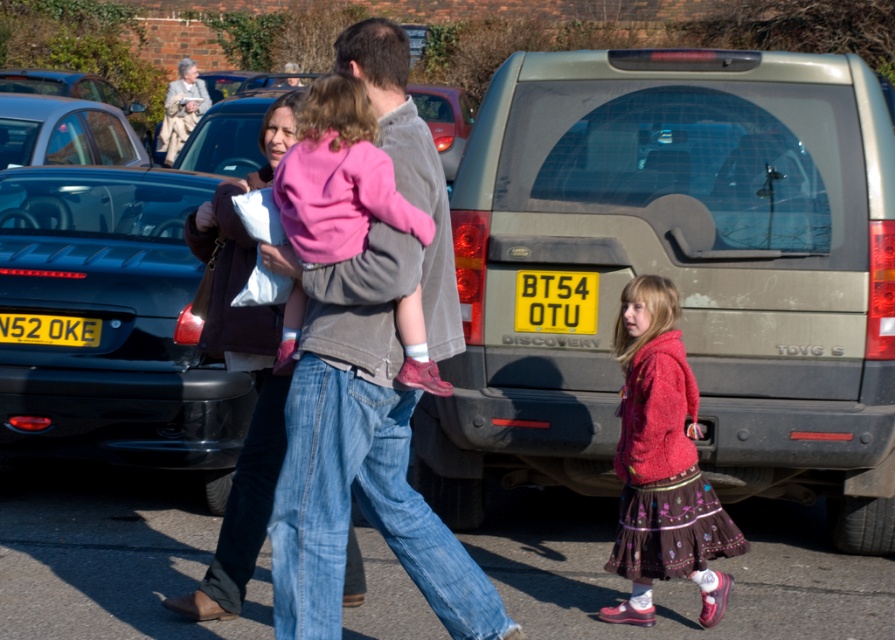
Who is positioned more to the left, fuzzy pink jacket at lower right or pink fleece jacket at center?

Positioned to the left is pink fleece jacket at center.

Is fuzzy pink jacket at lower right above pink fleece jacket at center?

No.

Is point (722, 509) positioned after point (339, 108)?

Yes, it is.

Locate an element on the screen. The height and width of the screenshot is (640, 895). fuzzy pink jacket at lower right is located at coordinates (662, 464).

From the picture: Can you confirm if matte gray minivan at center is positioned to the left of yellow plastic license plate at lower left?

No, matte gray minivan at center is not to the left of yellow plastic license plate at lower left.

Does matte gray minivan at center lie behind yellow plastic license plate at lower left?

No, matte gray minivan at center is closer to the viewer.

Is point (467, 385) positioned behind point (86, 323)?

No, (467, 385) is closer to viewer.

What are the coordinates of `matte gray minivan at center` in the screenshot? It's located at (679, 275).

Does matte brown jacket at center lie in front of pink fleece jacket at center?

No, it is behind pink fleece jacket at center.

Can you confirm if matte brown jacket at center is positioned to the right of pink fleece jacket at center?

Incorrect, matte brown jacket at center is not on the right side of pink fleece jacket at center.

Who is more forward, (361, 566) or (330, 173)?

Positioned in front is point (330, 173).

The image size is (895, 640). Identify the location of matte brown jacket at center. (241, 365).